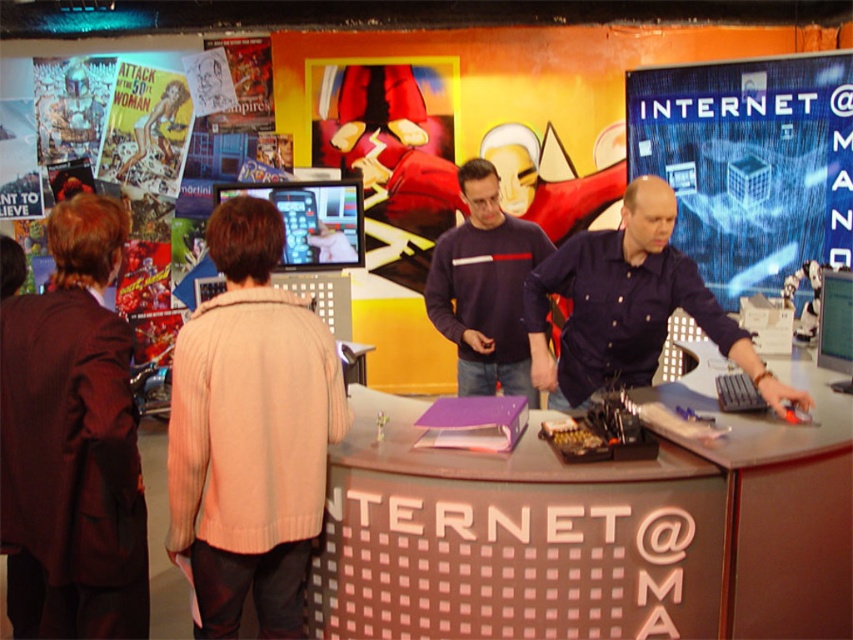
Question: Can you confirm if dark brown leather jacket at left is positioned to the right of blue digital screen at right?

Choices:
 (A) yes
 (B) no

Answer: (B)

Question: Estimate the real-world distances between objects in this image. Which object is closer to the blue digital screen at right?

Choices:
 (A) dark blue sweater at center
 (B) black plastic information desk at center
 (C) dark brown leather jacket at left
 (D) beige knitted sweater at center

Answer: (A)

Question: Which object is positioned closest to the black plastic information desk at center?

Choices:
 (A) beige knitted sweater at center
 (B) black plastic register at center
 (C) dark brown leather jacket at left
 (D) blue digital screen at right

Answer: (A)

Question: Considering the real-world distances, which object is closest to the black plastic information desk at center?

Choices:
 (A) dark blue sweater at center
 (B) dark blue shirt at center
 (C) black plastic register at center

Answer: (B)

Question: Can you confirm if blue digital screen at right is wider than dark blue shirt at center?

Choices:
 (A) no
 (B) yes

Answer: (B)

Question: Is black plastic information desk at center above black plastic register at center?

Choices:
 (A) yes
 (B) no

Answer: (B)